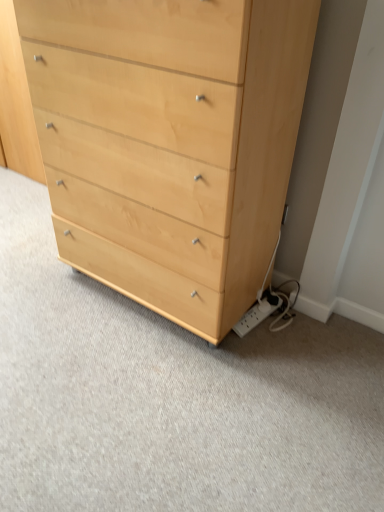
At what (x,y) coordinates should I click in order to perform the action: click on vacant space to the right of white plastic power strip at lower right. Please return your answer as a coordinate pair (x, y). This screenshot has height=512, width=384. Looking at the image, I should click on (297, 333).